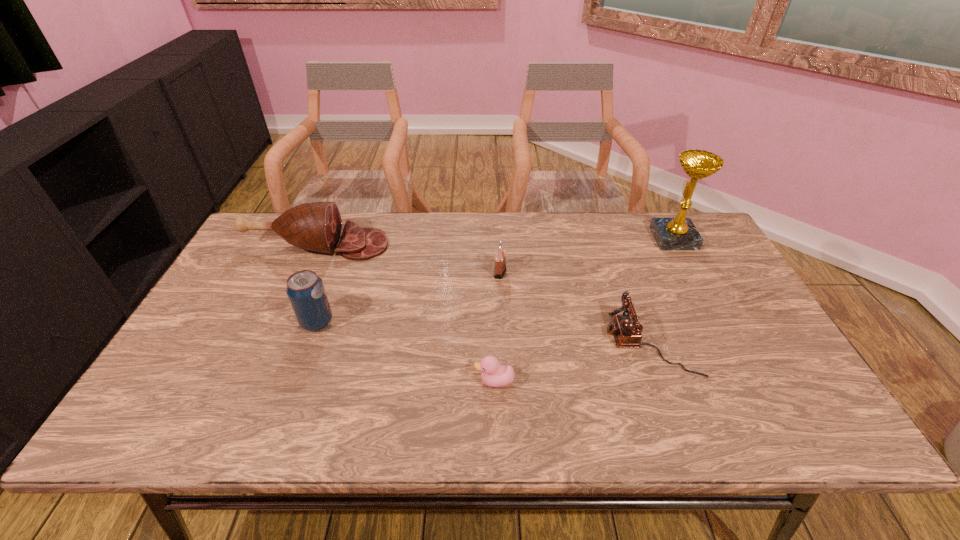
This screenshot has height=540, width=960. I want to click on ham that is at the far edge, so click(x=316, y=226).

This screenshot has height=540, width=960. I want to click on object positioned at the left edge, so click(316, 226).

Identify the location of object that is at the right edge. This screenshot has width=960, height=540. (679, 233).

You are a GUI agent. You are given a task and a screenshot of the screen. Output one action in this format:
    pyautogui.click(x=<x>, y=<y>)
    Task: Click on the object that is at the far left corner
    The width and height of the screenshot is (960, 540).
    Given the screenshot: What is the action you would take?
    point(316,226)

I want to click on object located in the far right corner section of the desktop, so click(x=679, y=233).

The height and width of the screenshot is (540, 960). Find the location of `vacant space at the far edge of the desktop`. vacant space at the far edge of the desktop is located at coordinates (366, 225).

The width and height of the screenshot is (960, 540). I want to click on vacant position at the near edge of the desktop, so click(x=591, y=415).

In the image, there is a desktop. Where is `vacant space at the left edge`? The height and width of the screenshot is (540, 960). vacant space at the left edge is located at coordinates (214, 322).

In the image, there is a desktop. At what (x,y) coordinates should I click in order to perform the action: click on vacant area at the near left corner. Please return your answer as a coordinate pair (x, y). Looking at the image, I should click on (132, 423).

Locate an element on the screen. The image size is (960, 540). vacant space at the far right corner of the desktop is located at coordinates (694, 219).